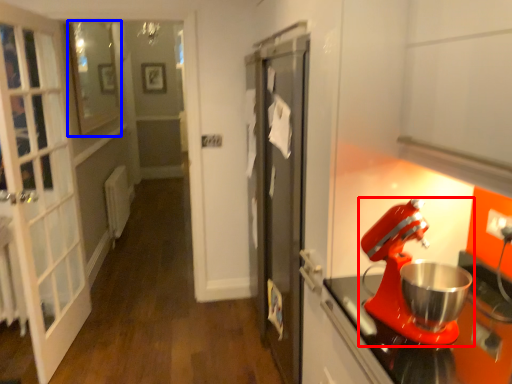
Question: Which object is further to the camera taking this photo, mixer (highlighted by a red box) or window (highlighted by a blue box)?

Choices:
 (A) mixer
 (B) window

Answer: (B)